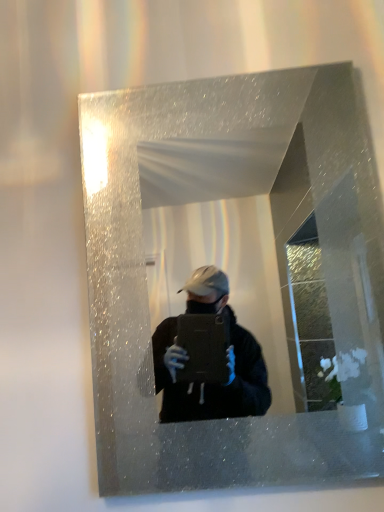
Question: Should I look upward or downward to see cracked glass mirror at center?

Choices:
 (A) down
 (B) up

Answer: (A)